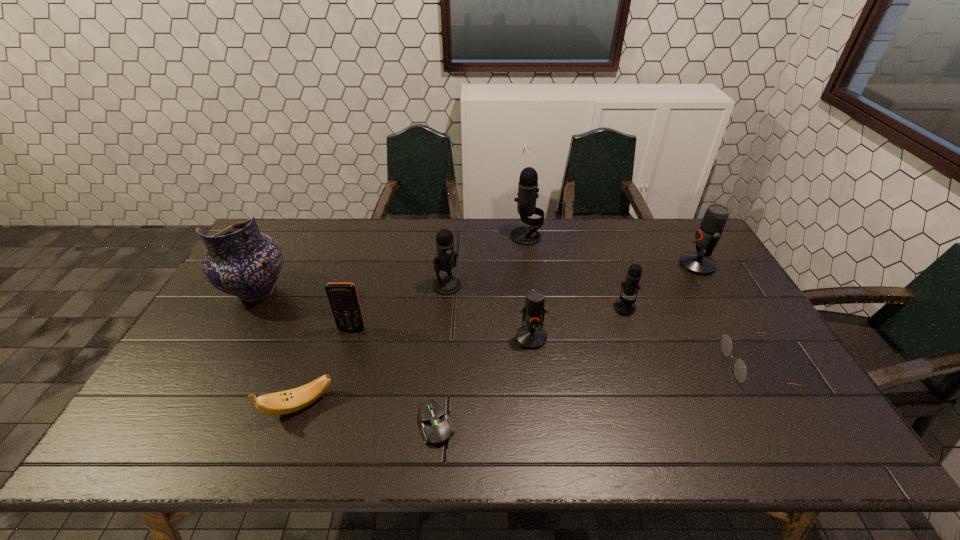
I want to click on the nearest black microphone, so click(x=623, y=306).

You are a GUI agent. You are given a task and a screenshot of the screen. Output one action in this format:
    pyautogui.click(x=<x>, y=<y>)
    Task: Click on the nearer red microphone
    Image resolution: width=960 pixels, height=540 pixels.
    Given the screenshot: What is the action you would take?
    pyautogui.click(x=531, y=336)

What are the coordinates of `the nearest microphone` in the screenshot? It's located at (531, 336).

Identify the location of yellow banana. This screenshot has height=540, width=960. (285, 402).

I want to click on banana, so click(285, 402).

Locate an element on the screen. Image resolution: width=960 pixels, height=540 pixels. gold spectacles is located at coordinates (740, 370).

Identify the location of spectacles. (740, 370).

Identify the location of computer mouse. This screenshot has height=540, width=960. (436, 428).

Find the location of a particular element. This screenshot has width=960, height=540. the shortest object is located at coordinates (436, 428).

At what (x,y) coordinates should I click in order to perform the action: click on blank space located 0.300m on the right of the second black microphone from left to right. Please return your answer as a coordinate pair (x, y). Image resolution: width=960 pixels, height=540 pixels. Looking at the image, I should click on (626, 237).